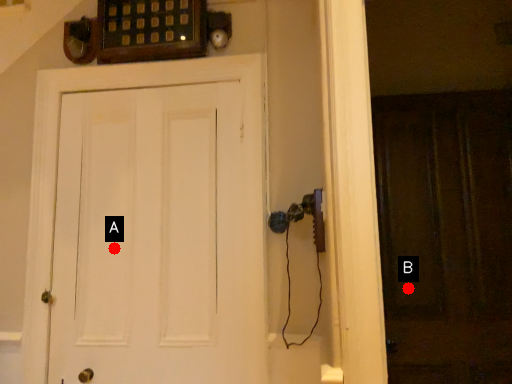
Question: Two points are circled on the image, labeled by A and B beside each circle. Which point is further to the camera?

Choices:
 (A) A is further
 (B) B is further

Answer: (B)